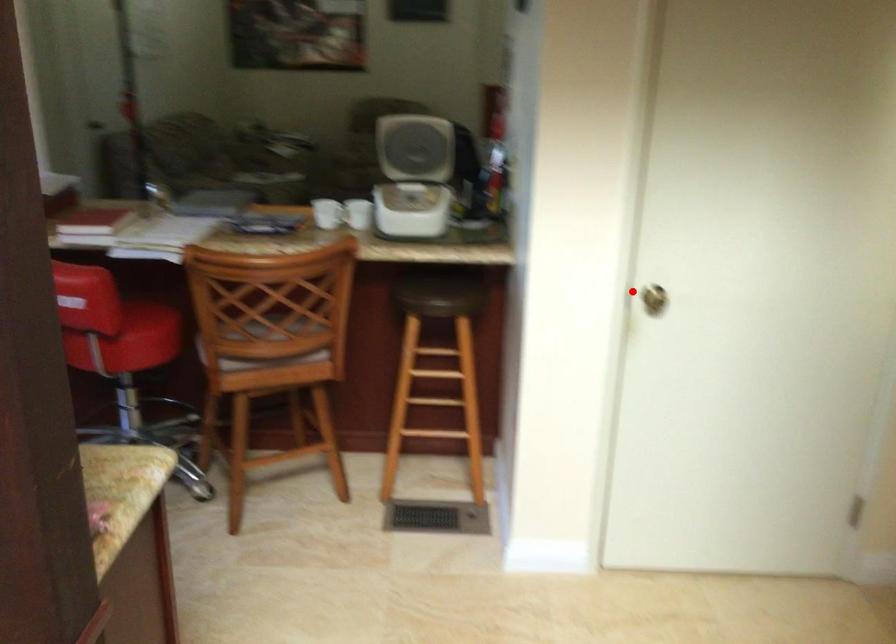
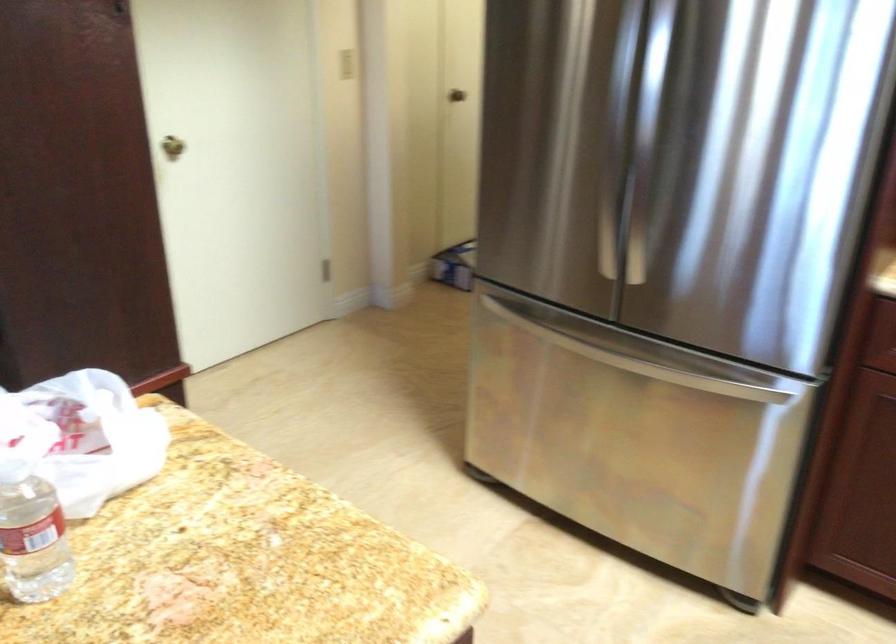
Locate, in the second image, the point that corresponds to the highlighted location in the first image.

(171, 146)